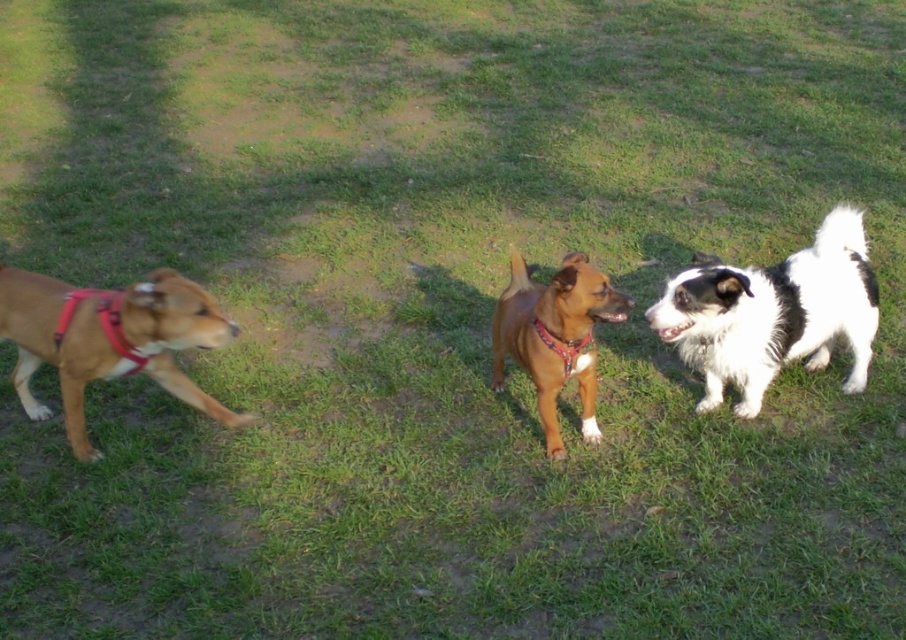
You are standing in the grassy area and want to walk from point A to point B. Point A is at coordinate point (227,412) and point B is at coordinate point (117,310). Which point is closer to you, point A or point B?

Point A at (227,412) is closer to you than point B at (117,310) because it is further to the viewer.

You are a dog owner who wants to ensure your brown matte dog at left has enough space to move freely while wearing its matte red harness at left. Based on the scene description, can you determine if the harness is appropriately sized for the dog?

The brown matte dog at left is larger in size than the matte red harness at left, which suggests that the harness may be too small for the dog, potentially restricting its movement.

You are a dog owner who wants to ensure your pets are properly fitted for their harnesses and collars. Looking at the image, which of the two items, the matte red harness at left or the red fabric collar at center, is more likely to be a proper fit for a larger dog?

The matte red harness at left has a larger size compared to the red fabric collar at center, so it is more likely to be a proper fit for a larger dog.